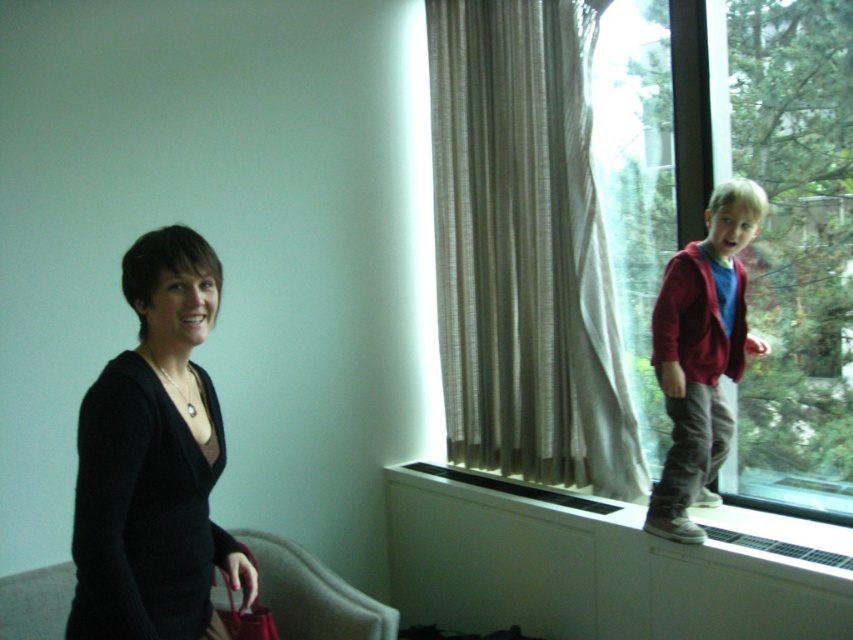
Does point (540, 205) lie in front of point (86, 438)?

No, (540, 205) is further to viewer.

What do you see at coordinates (640, 227) in the screenshot? I see `clear glass window at right` at bounding box center [640, 227].

You are a GUI agent. You are given a task and a screenshot of the screen. Output one action in this format:
    pyautogui.click(x=<x>, y=<y>)
    Task: Click on the clear glass window at right
    Image resolution: width=853 pixels, height=640 pixels.
    Given the screenshot: What is the action you would take?
    640,227

Between clear glass window at right and beige textured curtain at window, which one has less height?

beige textured curtain at window

Can you confirm if clear glass window at right is smaller than beige textured curtain at window?

Actually, clear glass window at right might be larger than beige textured curtain at window.

Find the location of `clear glass window at right`. clear glass window at right is located at coordinates (640, 227).

Which of these two, beige textured curtain at window or velvet beige armchair at lower left, stands shorter?

With less height is velvet beige armchair at lower left.

Does point (473, 64) lie behind point (341, 616)?

Yes, point (473, 64) is behind point (341, 616).

Is point (494, 52) farther from camera compared to point (280, 616)?

That is True.

You are a GUI agent. You are given a task and a screenshot of the screen. Output one action in this format:
    pyautogui.click(x=<x>, y=<y>)
    Task: Click on the beige textured curtain at window
    The height and width of the screenshot is (640, 853).
    Given the screenshot: What is the action you would take?
    pyautogui.click(x=524, y=250)